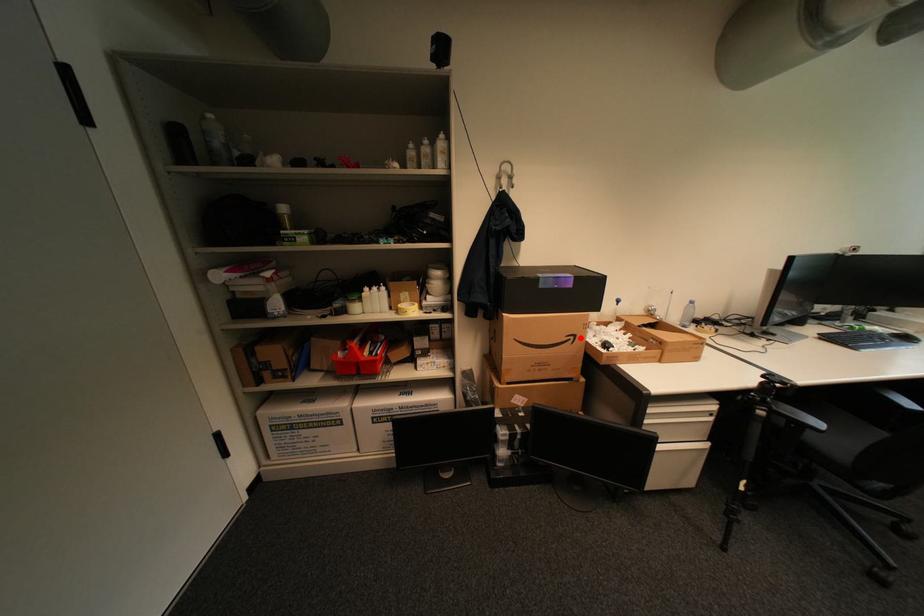
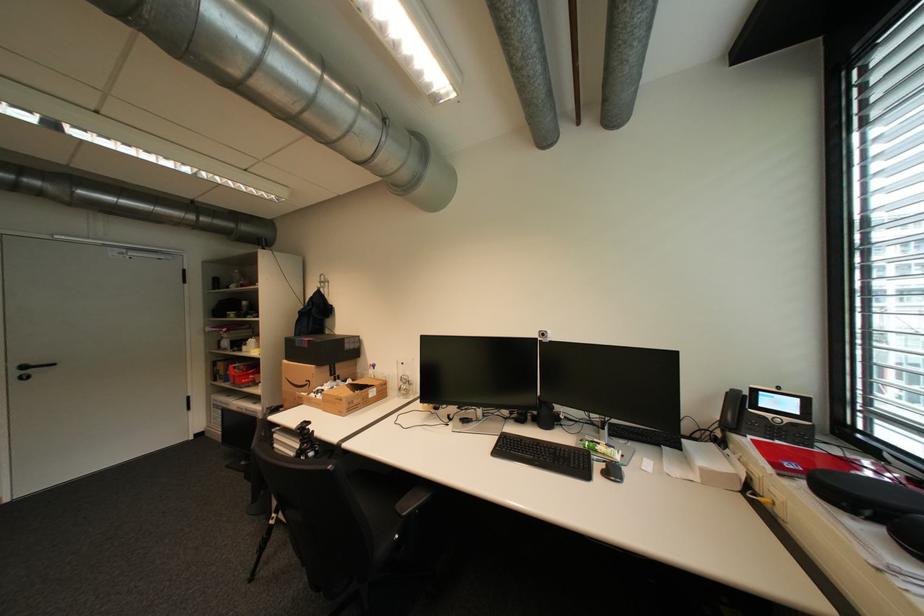
The point at the highlighted location is marked in the first image. Where is the corresponding point in the second image?

(317, 383)